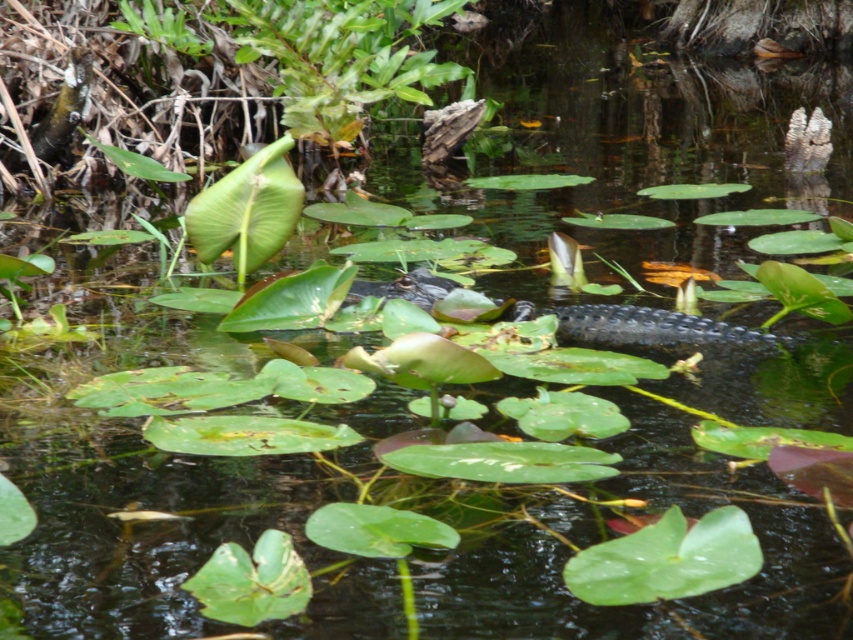
You are a photographer trying to capture a closeup of the dark green scaly crocodile at center without including the green leafy plant at upper left in the frame. Given their sizes, is it possible to do so?

The green leafy plant at upper left is wider than the dark green scaly crocodile at center. Therefore, it might be challenging to frame the crocodile without the plant appearing in the shot if the plant is positioned near the edge of the frame. However, since the crocodile is at the center and the plant is at the upper left, adjusting the camera angle or zoom could allow focusing solely on the crocodile by excluding the plant.

You are a photographer trying to capture a clear shot of the dark green scaly crocodile at center. However, there is a green leafy plant at upper left blocking your view. Can you move to the right to get a better angle?

The dark green scaly crocodile at center is behind the green leafy plant at upper left, so moving to the right might help you see around the plant and get a clearer view of the crocodile.